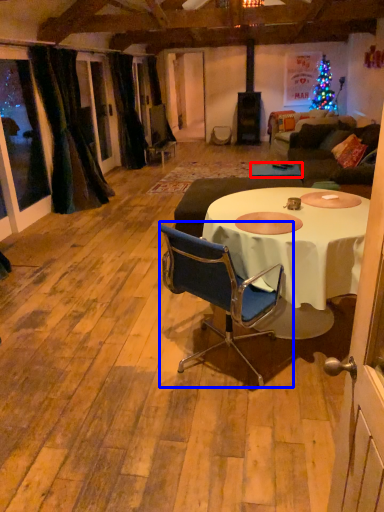
Question: Which object appears farthest to the camera in this image, table (highlighted by a red box) or chair (highlighted by a blue box)?

Choices:
 (A) table
 (B) chair

Answer: (A)